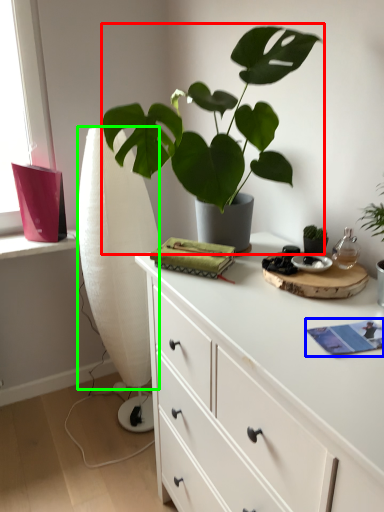
Question: Considering the real-world distances, which object is farthest from houseplant (highlighted by a red box)? book (highlighted by a blue box) or curtain (highlighted by a green box)?

Choices:
 (A) book
 (B) curtain

Answer: (B)